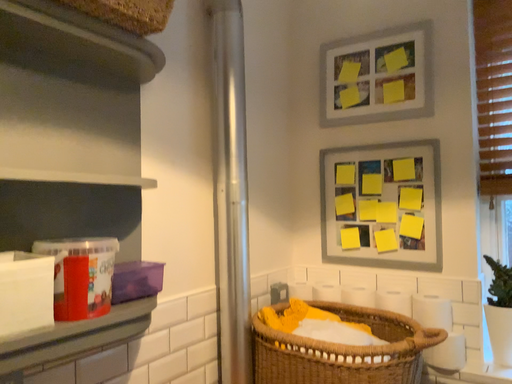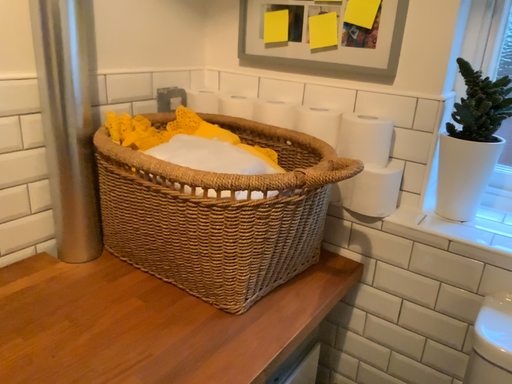
Question: How did the camera likely rotate when shooting the video?

Choices:
 (A) rotated downward
 (B) rotated upward

Answer: (A)